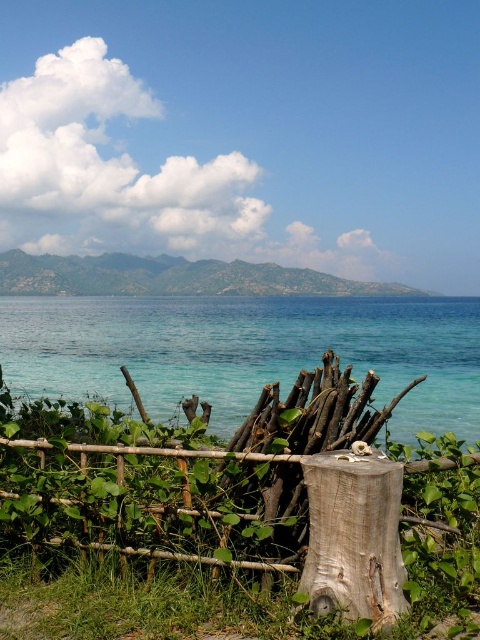
Question: Is green leafy vegetation at center below clear blue water at lower center?

Choices:
 (A) yes
 (B) no

Answer: (A)

Question: Considering the real-world distances, which object is closest to the light brown wood stump at center?

Choices:
 (A) clear blue water at lower center
 (B) green leafy vegetation at center

Answer: (B)

Question: Is green leafy vegetation at center wider than light brown wood stump at center?

Choices:
 (A) no
 (B) yes

Answer: (B)

Question: Does clear blue water at lower center appear over light brown wood stump at center?

Choices:
 (A) yes
 (B) no

Answer: (A)

Question: Which of the following is the closest to the observer?

Choices:
 (A) (344, 596)
 (B) (47, 548)

Answer: (A)

Question: Considering the real-world distances, which object is farthest from the green leafy vegetation at center?

Choices:
 (A) clear blue water at lower center
 (B) light brown wood stump at center

Answer: (A)